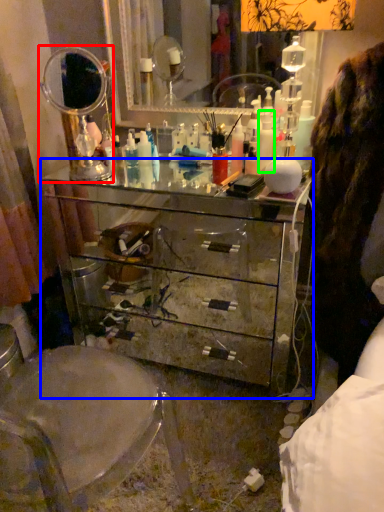
Question: Which object is positioned closest to mirror (highlighted by a red box)? Select from chest of drawers (highlighted by a blue box) and toiletry (highlighted by a green box).

Choices:
 (A) chest of drawers
 (B) toiletry

Answer: (A)